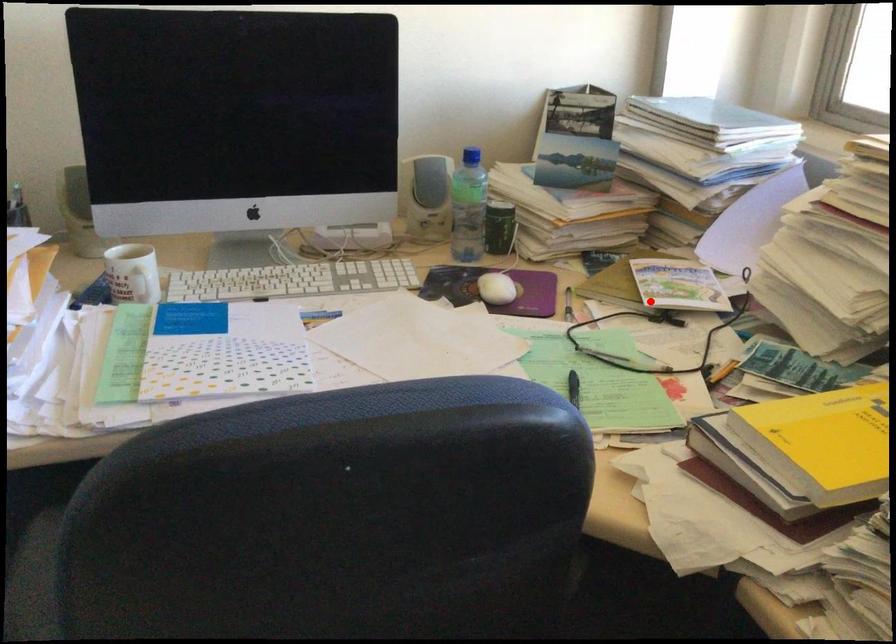
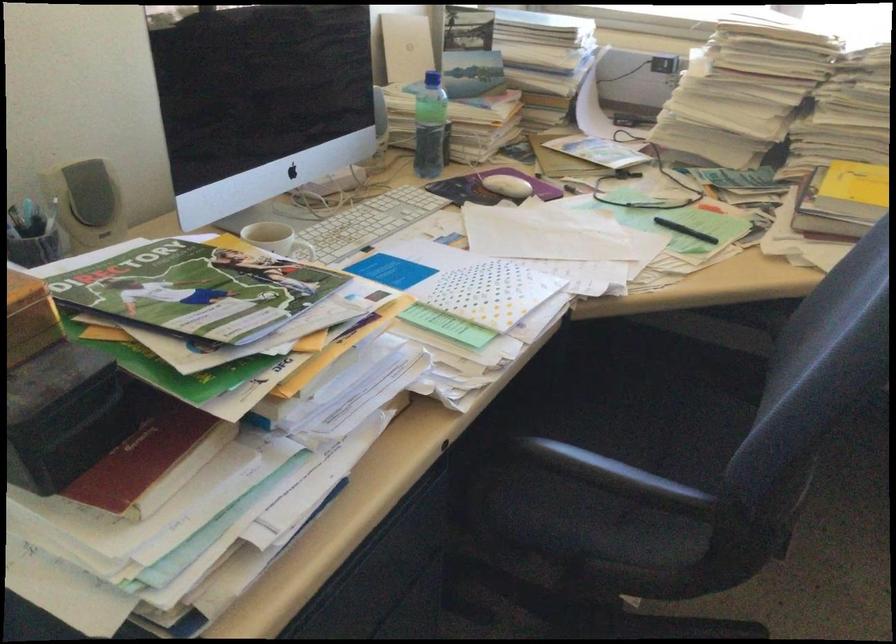
The point at the highlighted location is marked in the first image. Where is the corresponding point in the second image?

(610, 166)